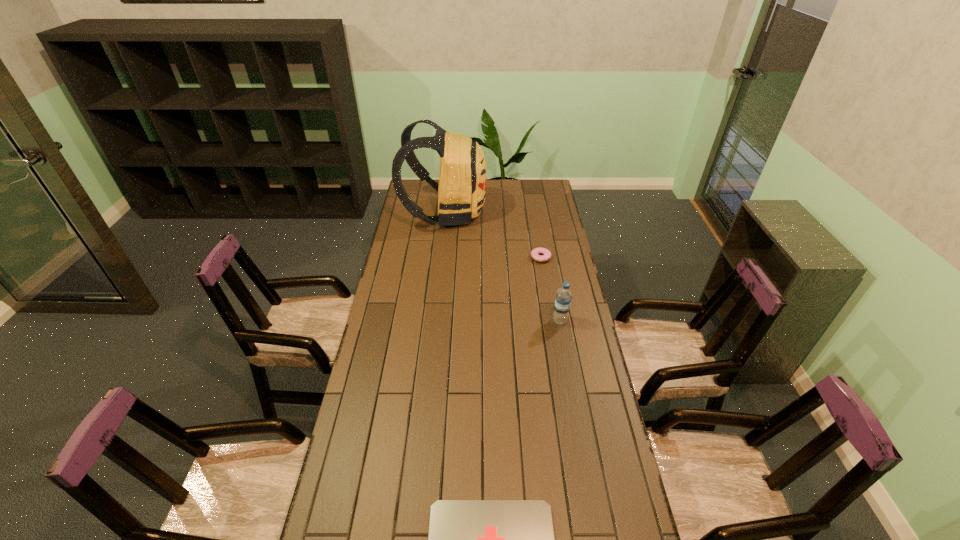
Find the location of `vacant space at the far right corner of the desktop`. vacant space at the far right corner of the desktop is located at coordinates (530, 179).

Image resolution: width=960 pixels, height=540 pixels. I want to click on free space between the water bottle and the tallest object, so click(x=502, y=267).

Locate an element on the screen. Image resolution: width=960 pixels, height=540 pixels. free space between the farthest object and the third farthest object is located at coordinates (502, 267).

This screenshot has height=540, width=960. Find the location of `vacant area that lies between the third nearest object and the farthest object`. vacant area that lies between the third nearest object and the farthest object is located at coordinates (492, 235).

Locate which object ranks third in proximity to the third farthest object. Please provide its 2D coordinates. Your answer should be formatted as a tuple, i.e. [(x, y)], where the tuple contains the x and y coordinates of a point satisfying the conditions above.

[(468, 539)]

Identify which object is the closest to the tallest object. Please provide its 2D coordinates. Your answer should be formatted as a tuple, i.e. [(x, y)], where the tuple contains the x and y coordinates of a point satisfying the conditions above.

[(545, 256)]

Find the location of a particular element. This screenshot has height=540, width=960. free spot that satisfies the following two spatial constraints: 1. on the front-facing side of the farthest object; 2. on the left side of the second shortest object is located at coordinates (440, 258).

Find the location of a particular element. vacant space that satisfies the following two spatial constraints: 1. on the front-facing side of the doughnut; 2. on the left side of the backpack is located at coordinates (440, 258).

Locate an element on the screen. The height and width of the screenshot is (540, 960). free space that satisfies the following two spatial constraints: 1. on the front-facing side of the doughnut; 2. on the left side of the tallest object is located at coordinates (440, 258).